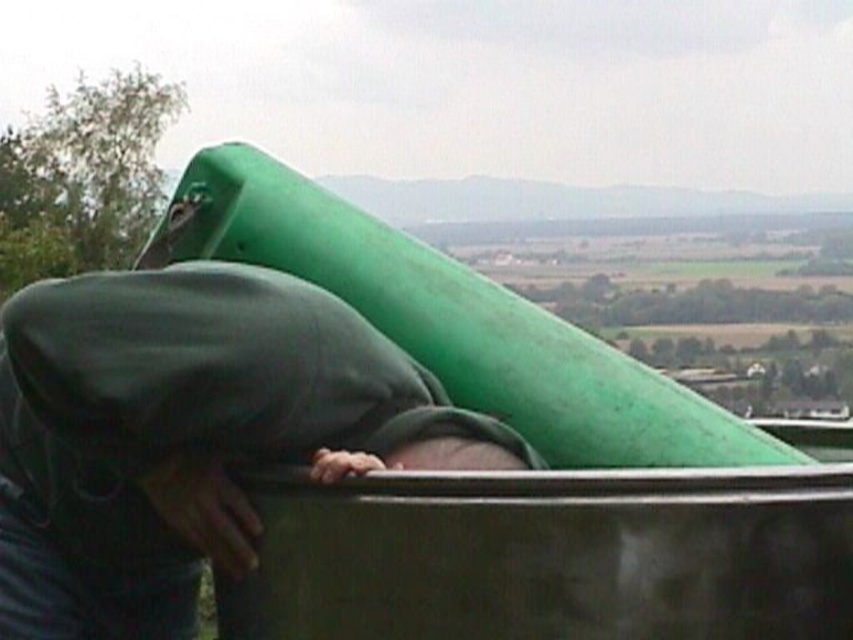
In the scene shown: Who is positioned more to the left, dark green fabric at center or green rubber slide at upper center?

dark green fabric at center

Between dark green fabric at center and green rubber slide at upper center, which one is positioned lower?

dark green fabric at center is below.

Image resolution: width=853 pixels, height=640 pixels. Find the location of `dark green fabric at center`. dark green fabric at center is located at coordinates (187, 433).